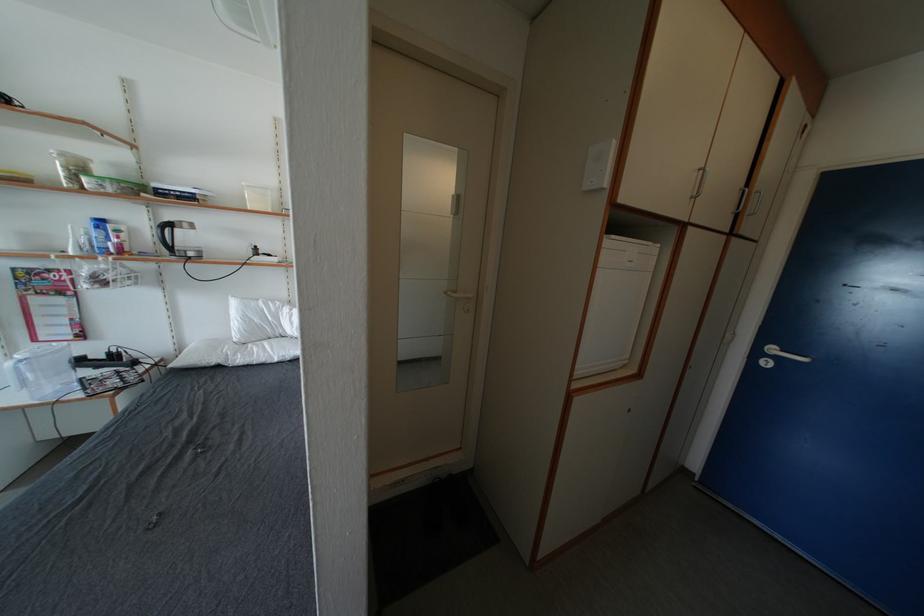
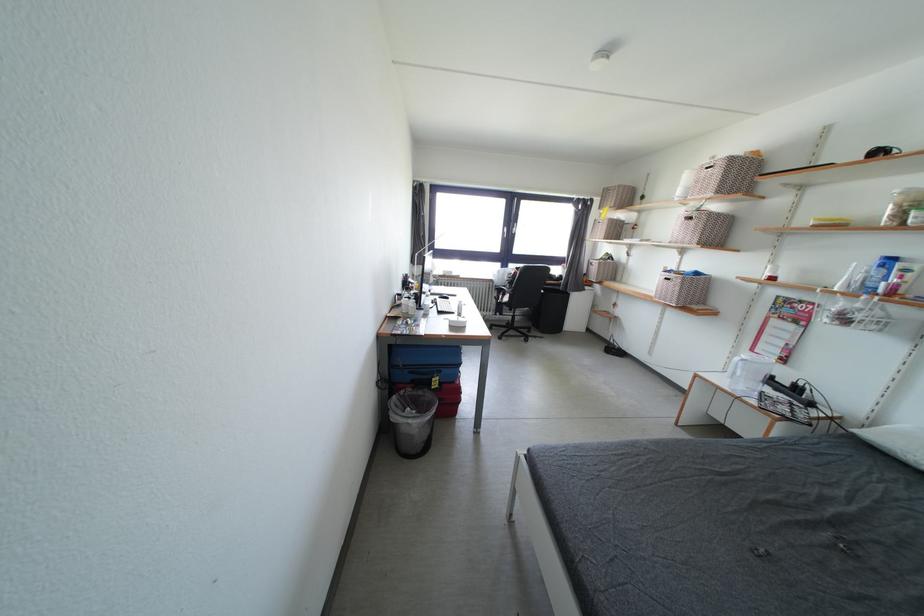
In the second image, find the point that corresponds to the point at 42,345 in the first image.

(759, 355)